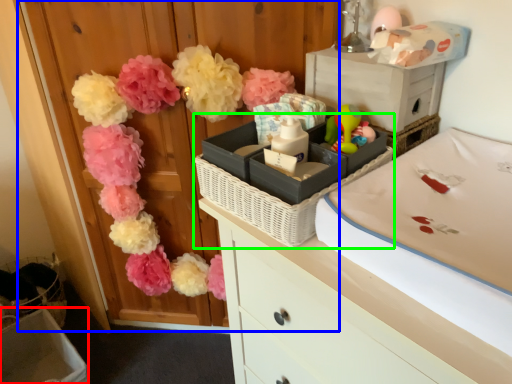
Question: Based on their relative distances, which object is nearer to storage box (highlighted by a red box)? Choose from armoire (highlighted by a blue box) and basket container (highlighted by a green box).

Choices:
 (A) armoire
 (B) basket container

Answer: (A)